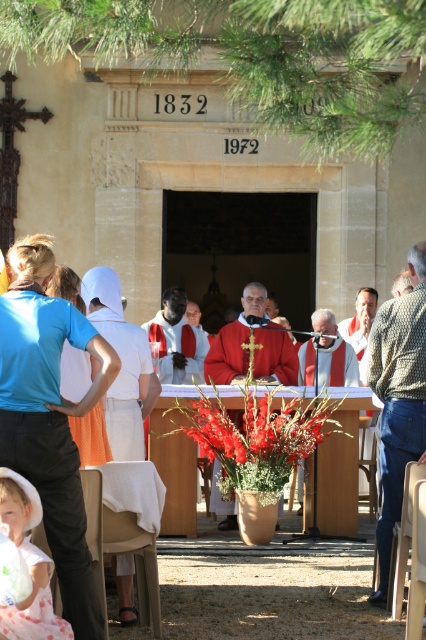
Does matte blue shirt at left have a smaller size compared to white cotton robe at left?

No, matte blue shirt at left is not smaller than white cotton robe at left.

Does matte blue shirt at left have a lesser height compared to white cotton robe at left?

No.

What do you see at coordinates (51, 428) in the screenshot? The image size is (426, 640). I see `matte blue shirt at left` at bounding box center [51, 428].

Where is `matte blue shirt at left`? matte blue shirt at left is located at coordinates (51, 428).

Consider the image. Who is shorter, knitted sweater at right or blue fabric shirt at left?

Standing shorter between the two is blue fabric shirt at left.

Does knitted sweater at right have a smaller size compared to blue fabric shirt at left?

Actually, knitted sweater at right might be larger than blue fabric shirt at left.

Describe the element at coordinates (399, 397) in the screenshot. This screenshot has height=640, width=426. I see `knitted sweater at right` at that location.

The image size is (426, 640). I want to click on knitted sweater at right, so click(399, 397).

Is matte blue shirt at left wider than knitted sweater at right?

Correct, the width of matte blue shirt at left exceeds that of knitted sweater at right.

Is matte blue shirt at left closer to the viewer compared to knitted sweater at right?

Yes, matte blue shirt at left is in front of knitted sweater at right.

What do you see at coordinates (51, 428) in the screenshot? I see `matte blue shirt at left` at bounding box center [51, 428].

You are a GUI agent. You are given a task and a screenshot of the screen. Output one action in this format:
    pyautogui.click(x=<x>, y=<y>)
    Task: Click on the matte blue shirt at left
    This screenshot has width=426, height=640.
    Given the screenshot: What is the action you would take?
    pyautogui.click(x=51, y=428)